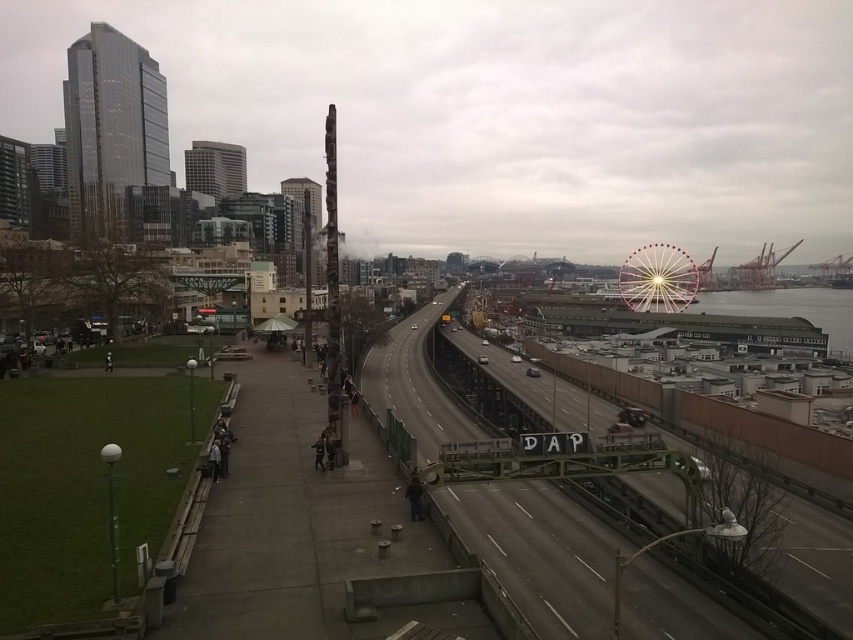
Question: Is metallic gray train track at center wider than pink metallic ferris wheel at upper right?

Choices:
 (A) yes
 (B) no

Answer: (A)

Question: Among these objects, which one is farthest from the camera?

Choices:
 (A) pink metallic ferris wheel at upper right
 (B) metallic gray train track at center

Answer: (A)

Question: Among these objects, which one is farthest from the camera?

Choices:
 (A) pink metallic ferris wheel at upper right
 (B) metallic gray train track at center

Answer: (A)

Question: Which of the following is the farthest from the observer?

Choices:
 (A) pink metallic ferris wheel at upper right
 (B) metallic gray train track at center

Answer: (A)

Question: Can you confirm if metallic gray train track at center is wider than pink metallic ferris wheel at upper right?

Choices:
 (A) no
 (B) yes

Answer: (B)

Question: Does metallic gray train track at center appear under pink metallic ferris wheel at upper right?

Choices:
 (A) yes
 (B) no

Answer: (A)